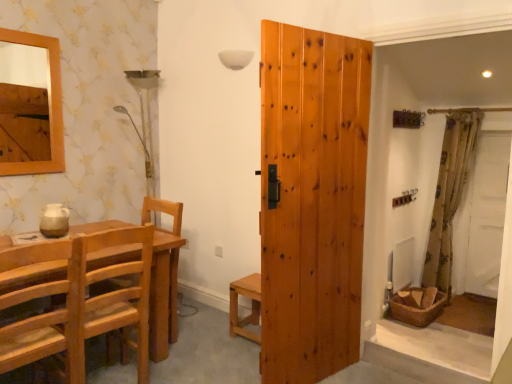
At what (x,y) coordinates should I click in order to perform the action: click on vacant space in front of light brown wooden stool at center. Please return your answer as a coordinate pair (x, y). Image resolution: width=512 pixels, height=384 pixels. Looking at the image, I should click on (239, 349).